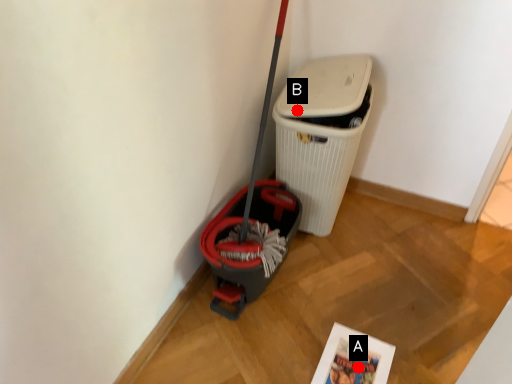
Question: Two points are circled on the image, labeled by A and B beside each circle. Which point is farther to the camera?

Choices:
 (A) A is further
 (B) B is further

Answer: (B)